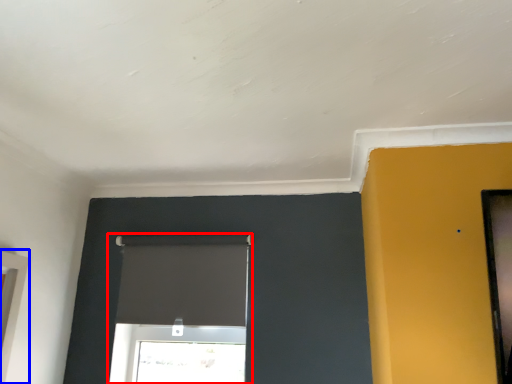
Question: Among these objects, which one is nearest to the camera, window (highlighted by a red box) or window (highlighted by a blue box)?

Choices:
 (A) window
 (B) window

Answer: (B)